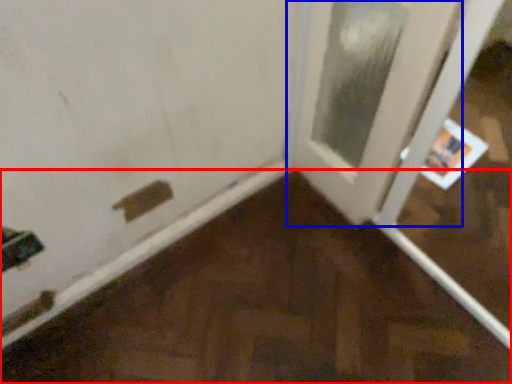
Question: Among these objects, which one is farthest to the camera, plywood (highlighted by a red box) or door (highlighted by a blue box)?

Choices:
 (A) plywood
 (B) door

Answer: (B)